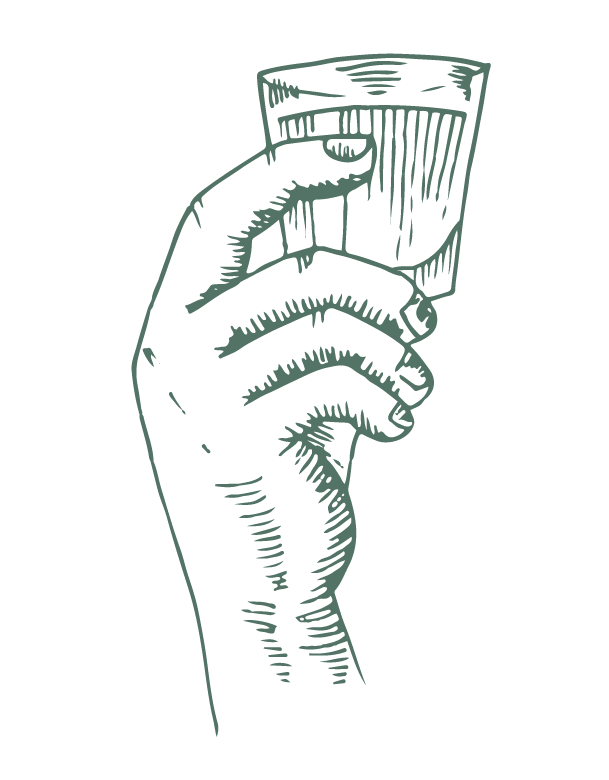
Find the location of a particular element. This screenshot has width=609, height=780. glass is located at coordinates (405, 154).